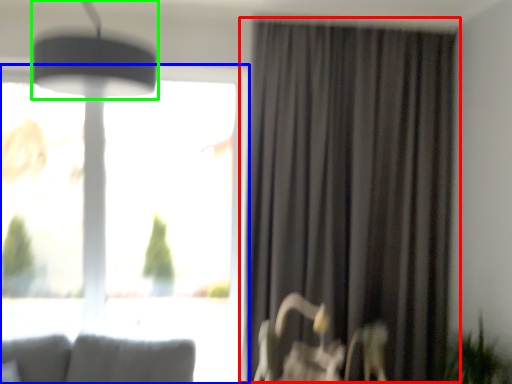
Question: Which object is the closest to the curtain (highlighted by a red box)? Choose among these: window (highlighted by a blue box) or lamp (highlighted by a green box).

Choices:
 (A) window
 (B) lamp

Answer: (A)